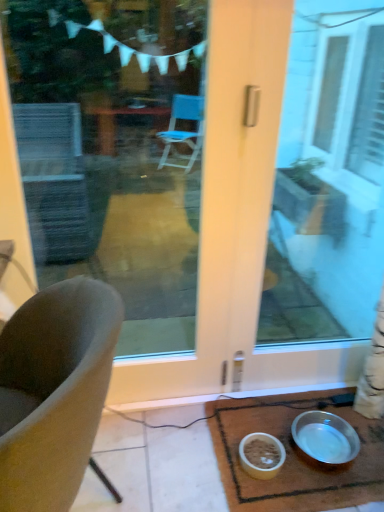
Find the location of a particular element. This screenshot has height=512, width=384. vacant space to the right of matte brown bowl at lower center, acting as the first bowl starting from the left is located at coordinates (309, 480).